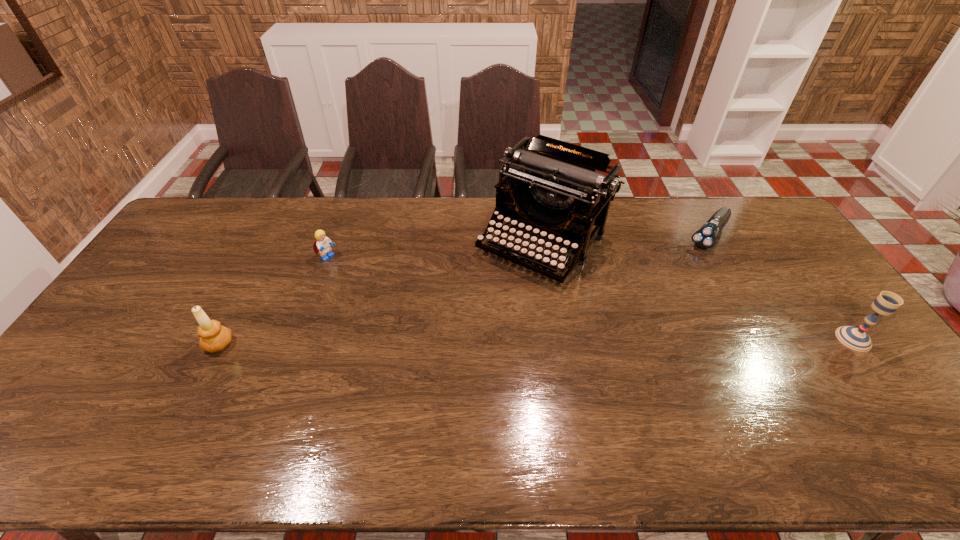
Locate an element on the screen. Image resolution: width=960 pixels, height=540 pixels. electric shaver at the far edge is located at coordinates (705, 237).

This screenshot has height=540, width=960. Find the location of `object that is at the right edge`. object that is at the right edge is located at coordinates (886, 303).

In the image, there is a desktop. Where is `blank space at the far edge`? Image resolution: width=960 pixels, height=540 pixels. blank space at the far edge is located at coordinates (252, 220).

In order to click on vacant space at the near edge of the desktop in this screenshot , I will do `click(145, 388)`.

Where is `vacant space at the left edge of the desktop`? The height and width of the screenshot is (540, 960). vacant space at the left edge of the desktop is located at coordinates (205, 246).

Identify the location of blank space at the right edge of the desktop. This screenshot has height=540, width=960. (804, 333).

Locate an element on the screen. The image size is (960, 540). vacant space at the far left corner of the desktop is located at coordinates (231, 211).

Where is `unoccupied area between the chalice and the tallest object`? unoccupied area between the chalice and the tallest object is located at coordinates (698, 291).

Find the location of a particular element. This screenshot has width=960, height=540. vacant area between the third object from right to left and the Lego is located at coordinates (435, 251).

Where is `free spot between the leftmost object and the shortest object`? This screenshot has height=540, width=960. free spot between the leftmost object and the shortest object is located at coordinates (464, 290).